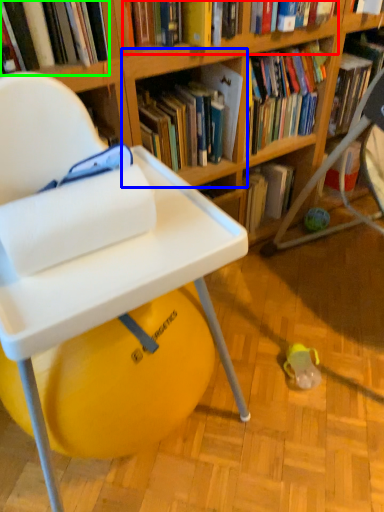
Question: Which object is positioned closest to book (highlighted by a red box)? Select from shelf (highlighted by a blue box) and book (highlighted by a green box).

Choices:
 (A) shelf
 (B) book

Answer: (A)